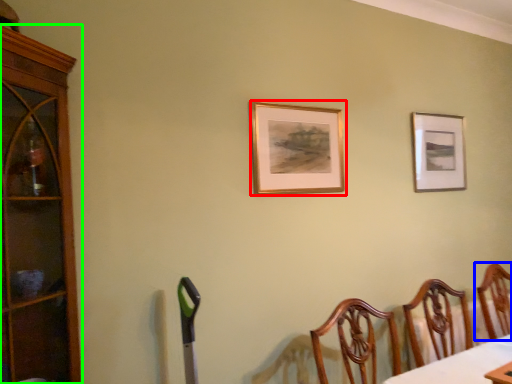
Question: Estimate the real-world distances between objects in this image. Which object is farther from picture frame (highlighted by a red box), chair (highlighted by a blue box) or cabinetry (highlighted by a green box)?

Choices:
 (A) chair
 (B) cabinetry

Answer: (A)